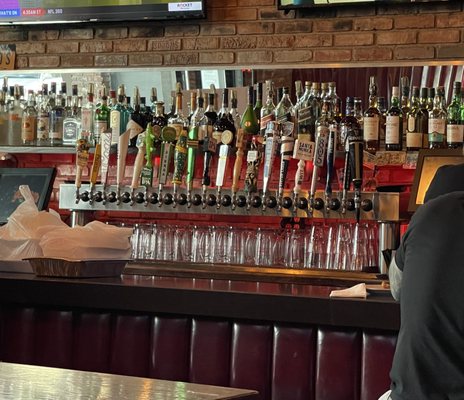
Where is `mirror`? Image resolution: width=464 pixels, height=400 pixels. mirror is located at coordinates (124, 88).